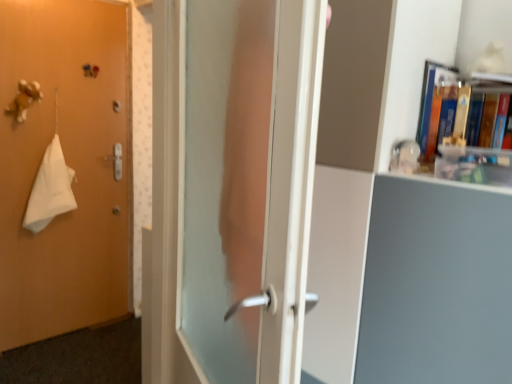
Question: Does matte orange door at left appear on the right side of matte white bookcase at center?

Choices:
 (A) no
 (B) yes

Answer: (A)

Question: Is matte orange door at left behind matte white bookcase at center?

Choices:
 (A) yes
 (B) no

Answer: (A)

Question: Is matte orange door at left positioned with its back to matte white bookcase at center?

Choices:
 (A) yes
 (B) no

Answer: (B)

Question: Is matte orange door at left taller than matte white bookcase at center?

Choices:
 (A) yes
 (B) no

Answer: (A)

Question: From a real-world perspective, is matte orange door at left below matte white bookcase at center?

Choices:
 (A) yes
 (B) no

Answer: (A)

Question: In the image, is matte white bookcase at center positioned in front of or behind white cloth at left?

Choices:
 (A) front
 (B) behind

Answer: (A)

Question: Based on their positions, is matte white bookcase at center located to the left or right of white cloth at left?

Choices:
 (A) right
 (B) left

Answer: (A)

Question: Would you say matte white bookcase at center is inside or outside white cloth at left?

Choices:
 (A) inside
 (B) outside

Answer: (B)

Question: Is matte white bookcase at center bigger or smaller than white cloth at left?

Choices:
 (A) big
 (B) small

Answer: (A)

Question: Would you say matte white bookcase at center is inside or outside hardcover book at upper right?

Choices:
 (A) inside
 (B) outside

Answer: (B)

Question: In terms of height, does matte white bookcase at center look taller or shorter compared to hardcover book at upper right?

Choices:
 (A) short
 (B) tall

Answer: (B)

Question: From a real-world perspective, is matte white bookcase at center above or below hardcover book at upper right?

Choices:
 (A) below
 (B) above

Answer: (A)

Question: Considering the relative positions of matte white bookcase at center and hardcover book at upper right in the image provided, is matte white bookcase at center to the left or to the right of hardcover book at upper right?

Choices:
 (A) right
 (B) left

Answer: (B)

Question: From a real-world perspective, is transparent glass door at center above or below matte white bookcase at center?

Choices:
 (A) below
 (B) above

Answer: (B)

Question: Is transparent glass door at center bigger or smaller than matte white bookcase at center?

Choices:
 (A) small
 (B) big

Answer: (A)